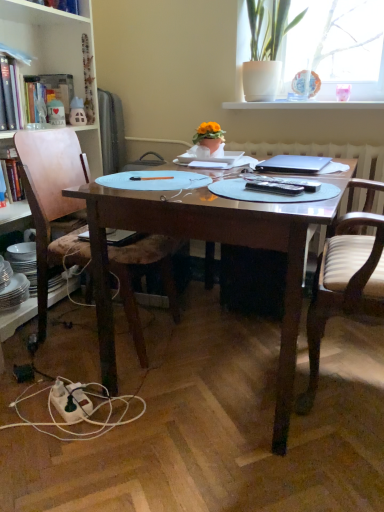
The height and width of the screenshot is (512, 384). Describe the element at coordinates (212, 245) in the screenshot. I see `wooden desk at center` at that location.

Based on the photo, measure the distance between white ceramic pot at upper right and camera.

white ceramic pot at upper right is 7.11 feet from camera.

The width and height of the screenshot is (384, 512). What do you see at coordinates (10, 93) in the screenshot?
I see `hardcover book at left, which is counted as the 3th book, starting from the back` at bounding box center [10, 93].

In order to face white ceramic house at upper left, which is counted as the second toy, starting from the left, should I rotate leftwards or rightwards?

A 15.013 degree turn to the left will do.

Find the location of a particular element. The width and height of the screenshot is (384, 512). silver metallic laptop at center is located at coordinates (293, 164).

The height and width of the screenshot is (512, 384). I want to click on wooden chair at left, marked as the second chair in a right-to-left arrangement, so click(52, 202).

This screenshot has height=512, width=384. Describe the element at coordinates (49, 91) in the screenshot. I see `matte white book at upper left, the 1th book from the back` at that location.

Find the location of a particular element. This screenshot has height=512, width=384. wooden desk at center is located at coordinates (212, 245).

Measure the distance between white glossy window sill at upper center and silver metallic laptop at center.

A distance of 24.13 inches exists between white glossy window sill at upper center and silver metallic laptop at center.

Can silver metallic laptop at center be found inside white glossy window sill at upper center?

That's incorrect, silver metallic laptop at center is not inside white glossy window sill at upper center.

Does point (322, 104) appear closer or farther from the camera than point (321, 167)?

Clearly, point (322, 104) is more distant from the camera than point (321, 167).

Does wooden chair at left, marked as the second chair in a right-to-left arrangement, have a lesser width compared to hardcover book at left, which is counted as the 3th book, starting from the back?

No.

Is wooden chair at left, acting as the first chair starting from the left, at the left side of hardcover book at left, which is counted as the first book, starting from the front?

In fact, wooden chair at left, acting as the first chair starting from the left, is to the right of hardcover book at left, which is counted as the first book, starting from the front.

Based on the photo, is wooden chair at left, marked as the second chair in a right-to-left arrangement, aimed at hardcover book at left, which is counted as the first book, starting from the front?

No, wooden chair at left, marked as the second chair in a right-to-left arrangement, is not aimed at hardcover book at left, which is counted as the first book, starting from the front.

Measure the distance from wooden chair at left, acting as the first chair starting from the left, to hardcover book at left, which is counted as the 3th book, starting from the back.

22.29 inches.

From the image's perspective, is hardcover book at left, which is the second book from back to front, located above or below white ceramic house at upper left, the first toy in the right-to-left sequence?

From the image's perspective, hardcover book at left, which is the second book from back to front, appears below white ceramic house at upper left, the first toy in the right-to-left sequence.

Is hardcover book at left, which is the second book from back to front, next to white ceramic house at upper left, which is counted as the second toy, starting from the left, and touching it?

hardcover book at left, which is the second book from back to front, is not next to white ceramic house at upper left, which is counted as the second toy, starting from the left, and they're not touching.

Considering the sizes of objects hardcover book at left, acting as the 2th book starting from the front, and white ceramic house at upper left, which is counted as the second toy, starting from the left, in the image provided, who is taller, hardcover book at left, acting as the 2th book starting from the front, or white ceramic house at upper left, which is counted as the second toy, starting from the left,?

hardcover book at left, acting as the 2th book starting from the front, is taller.

Measure the distance from hardcover book at left, acting as the 2th book starting from the front, to white ceramic house at upper left, the first toy in the right-to-left sequence.

hardcover book at left, acting as the 2th book starting from the front, and white ceramic house at upper left, the first toy in the right-to-left sequence, are 17.41 inches apart.

Would you say white ceramic pot at upper right is part of white striped wood chair at right, the first chair positioned from the right,'s contents?

That's incorrect, white ceramic pot at upper right is not inside white striped wood chair at right, the first chair positioned from the right.

Where is `houseplant to the left of white striped wood chair at right, marked as the second chair in a left-to-right arrangement`? This screenshot has height=512, width=384. houseplant to the left of white striped wood chair at right, marked as the second chair in a left-to-right arrangement is located at coordinates (266, 48).

From a real-world perspective, is white striped wood chair at right, marked as the second chair in a left-to-right arrangement, physically located above or below white ceramic pot at upper right?

From a real-world perspective, white striped wood chair at right, marked as the second chair in a left-to-right arrangement, is physically below white ceramic pot at upper right.

Considering the sizes of white plastic power outlet at lower left and wooden bookcase at left in the image, is white plastic power outlet at lower left wider or thinner than wooden bookcase at left?

Clearly, white plastic power outlet at lower left has less width compared to wooden bookcase at left.

Considering the sizes of objects white plastic power outlet at lower left and wooden bookcase at left in the image provided, who is smaller, white plastic power outlet at lower left or wooden bookcase at left?

white plastic power outlet at lower left.

You are a GUI agent. You are given a task and a screenshot of the screen. Output one action in this format:
    pyautogui.click(x=<x>, y=<y>)
    Task: Click on the power outlet lying on the right of wooden bookcase at left
    
    Given the screenshot: What is the action you would take?
    pyautogui.click(x=70, y=401)

From the picture: Does matte white book at upper left, placed as the third book when sorted from front to back, have a greater width compared to wooden chair at left, acting as the first chair starting from the left?

Incorrect, the width of matte white book at upper left, placed as the third book when sorted from front to back, does not surpass that of wooden chair at left, acting as the first chair starting from the left.

Which is behind, point (63, 104) or point (172, 306)?

The point (63, 104) is more distant.

From a real-world perspective, is matte white book at upper left, the 1th book from the back, over wooden chair at left, acting as the first chair starting from the left?

Yes, from a real-world perspective, matte white book at upper left, the 1th book from the back, is above wooden chair at left, acting as the first chair starting from the left.

Can we say matte white book at upper left, placed as the third book when sorted from front to back, lies outside wooden chair at left, acting as the first chair starting from the left?

Indeed, matte white book at upper left, placed as the third book when sorted from front to back, is completely outside wooden chair at left, acting as the first chair starting from the left.

Is hardcover book at left, which is the second book from back to front, facing away from wooden chair at left, marked as the second chair in a right-to-left arrangement?

hardcover book at left, which is the second book from back to front, does not have its back to wooden chair at left, marked as the second chair in a right-to-left arrangement.

Can you tell me how much hardcover book at left, acting as the 2th book starting from the front, and wooden chair at left, acting as the first chair starting from the left, differ in facing direction?

2.31 degrees.

Between point (6, 176) and point (74, 257), which one is positioned in front?

The point (74, 257) is closer to the camera.

Does hardcover book at left, which is the second book from back to front, have a greater height compared to wooden chair at left, marked as the second chair in a right-to-left arrangement?

In fact, hardcover book at left, which is the second book from back to front, may be shorter than wooden chair at left, marked as the second chair in a right-to-left arrangement.

Where is `window sill above the silver metallic laptop at center (from the image's perspective)`? The height and width of the screenshot is (512, 384). window sill above the silver metallic laptop at center (from the image's perspective) is located at coordinates (303, 105).

There is a wooden chair at left, acting as the first chair starting from the left. At what (x,y) coordinates should I click in order to perform the action: click on the 3rd book above it (from a real-world perspective). Please return your answer as a coordinate pair (x, y). This screenshot has height=512, width=384. Looking at the image, I should click on (10, 93).

Looking at this image, looking at the image, which one is located closer to wooden bookcase at left, silver metallic laptop at center or matte white book at upper left, the 1th book from the back?

The object closer to wooden bookcase at left is matte white book at upper left, the 1th book from the back.

From the picture: Looking at the image, which one is located further to white plastic power outlet at lower left, wooden desk at center or white glossy window sill at upper center?

white glossy window sill at upper center is further to white plastic power outlet at lower left.

When comparing their distances from white plastic power outlet at lower left, does wooden desk at center or matte plastic toy at upper left, acting as the 1th toy starting from the left, seem closer?

wooden desk at center is closer to white plastic power outlet at lower left.

When comparing their distances from wooden desk at center, does matte white book at upper left, placed as the third book when sorted from front to back, or white ceramic pot at upper right seem further?

Based on the image, white ceramic pot at upper right appears to be further to wooden desk at center.

Estimate the real-world distances between objects in this image. Which object is further from matte white book at upper left, the 1th book from the back, white plastic power outlet at lower left or wooden bookcase at left?

white plastic power outlet at lower left.

Looking at the image, which one is located closer to wooden chair at left, acting as the first chair starting from the left, matte white book at upper left, placed as the third book when sorted from front to back, or hardcover book at left, which is counted as the 3th book, starting from the back?

Based on the image, hardcover book at left, which is counted as the 3th book, starting from the back, appears to be nearer to wooden chair at left, acting as the first chair starting from the left.

Looking at the image, which one is located closer to wooden desk at center, wooden chair at left, acting as the first chair starting from the left, or matte white book at upper left, placed as the third book when sorted from front to back?

wooden chair at left, acting as the first chair starting from the left.

Based on their spatial positions, is wooden desk at center or white striped wood chair at right, marked as the second chair in a left-to-right arrangement, further from white glossy window sill at upper center?

wooden desk at center is further to white glossy window sill at upper center.

At what (x,y) coordinates should I click in order to perform the action: click on power outlet between wooden bookcase at left and white striped wood chair at right, the first chair positioned from the right, in the horizontal direction. Please return your answer as a coordinate pair (x, y). This screenshot has width=384, height=512. Looking at the image, I should click on (70, 401).

Where is `chair located between hardcover book at left, which is counted as the 3th book, starting from the back, and white ceramic pot at upper right in the left-right direction`? chair located between hardcover book at left, which is counted as the 3th book, starting from the back, and white ceramic pot at upper right in the left-right direction is located at coordinates (52, 202).

Locate an element on the screen. The image size is (384, 512). laptop between wooden chair at left, marked as the second chair in a right-to-left arrangement, and white striped wood chair at right, the first chair positioned from the right is located at coordinates (293, 164).

Locate an element on the screen. This screenshot has width=384, height=512. toy positioned between wooden chair at left, marked as the second chair in a right-to-left arrangement, and white ceramic house at upper left, which is counted as the second toy, starting from the left, from near to far is located at coordinates (56, 113).